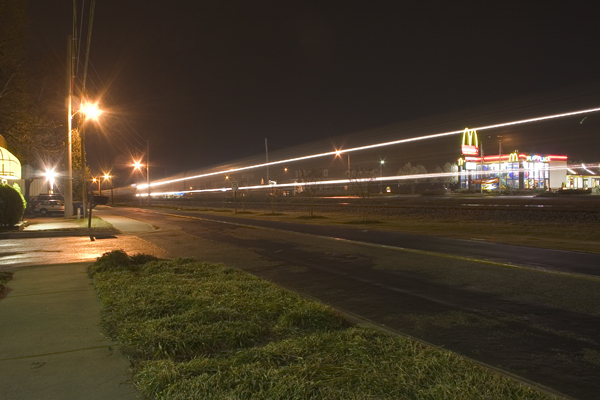
The image size is (600, 400). In order to click on windows in this screenshot , I will do `click(498, 168)`, `click(486, 170)`, `click(537, 169)`, `click(581, 181)`, `click(434, 397)`.